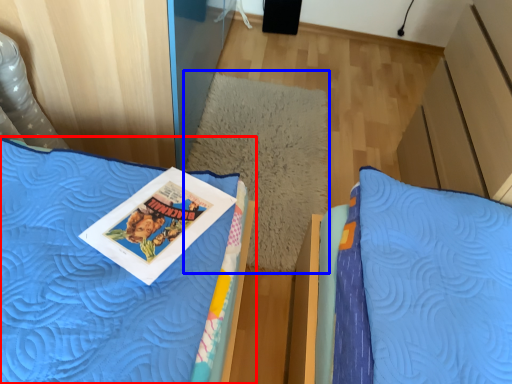
Question: Which object is closer to the camera taking this photo, bed (highlighted by a red box) or pillow (highlighted by a blue box)?

Choices:
 (A) bed
 (B) pillow

Answer: (A)